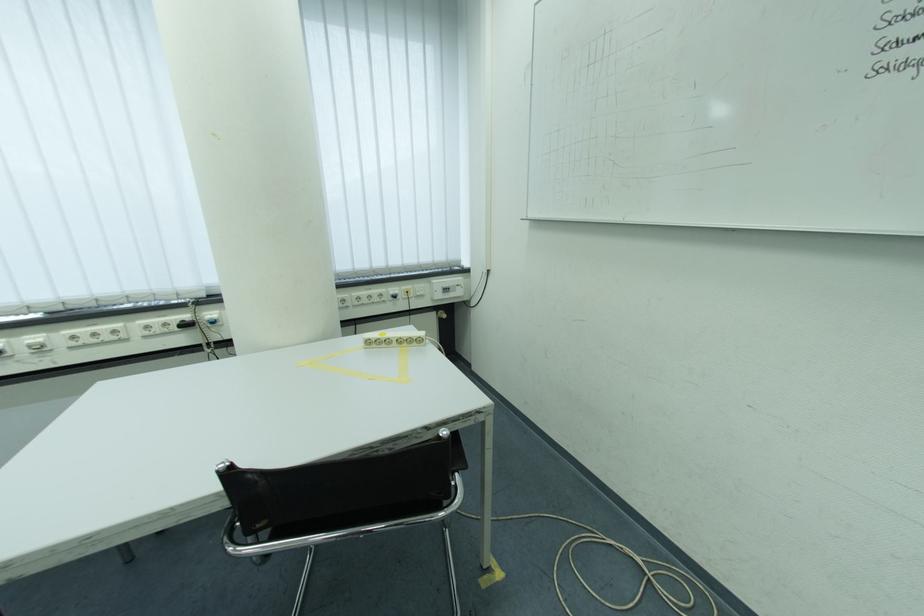
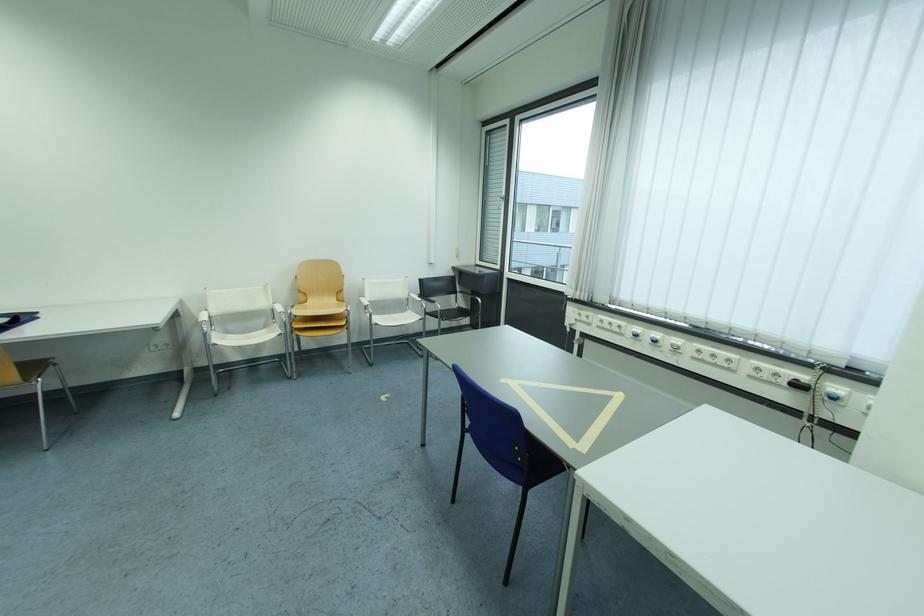
Question: The first image is from the beginning of the video and the second image is from the end. How did the camera likely rotate when shooting the video?

Choices:
 (A) Left
 (B) Right
 (C) Up
 (D) Down

Answer: (A)